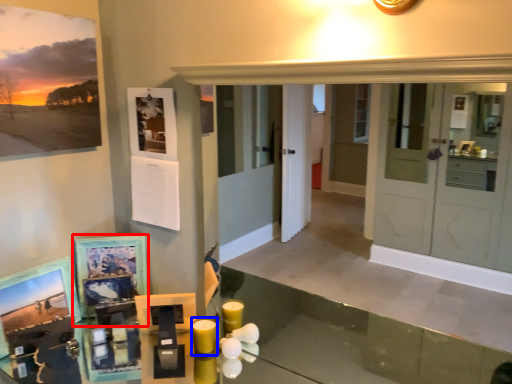
Question: Which of the following is the farthest to the observer, picture frame (highlighted by a red box) or candle (highlighted by a blue box)?

Choices:
 (A) picture frame
 (B) candle

Answer: (A)